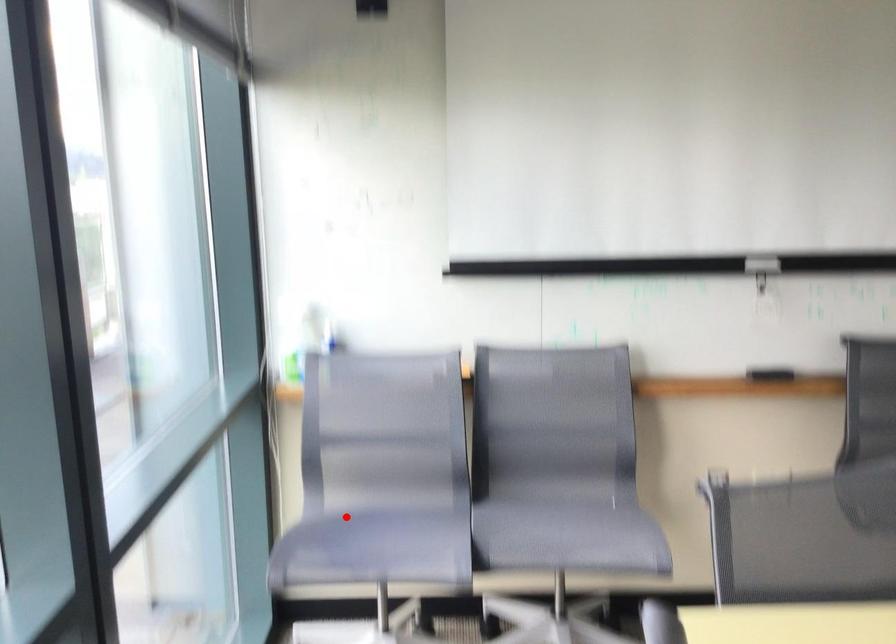
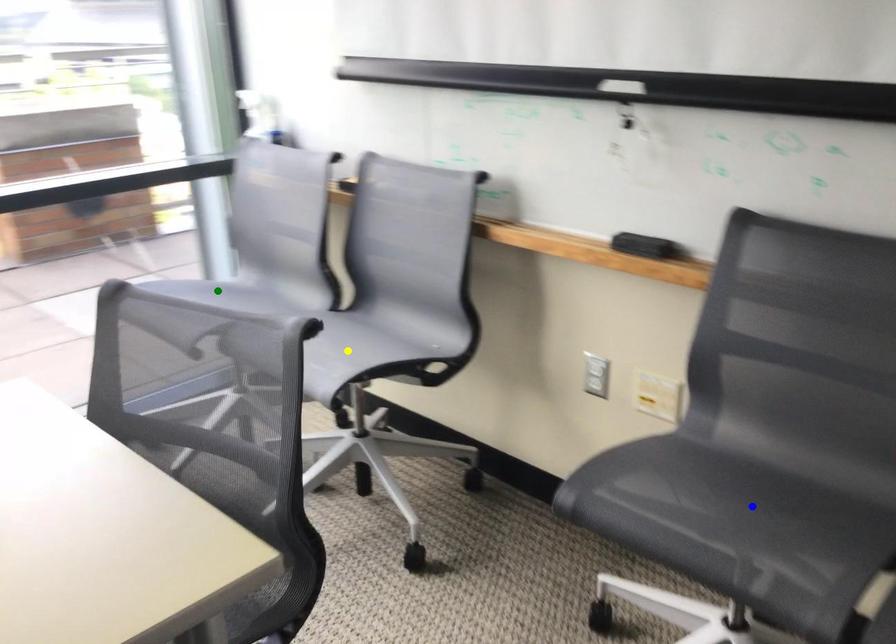
Question: I am providing you with two images of the same scene from different viewpoints. A red point is marked on the first image. You are given multiple points on the second image. Which point in image 2 represents the same 3d spot as the red point in image 1?

Choices:
 (A) blue point
 (B) green point
 (C) yellow point

Answer: (B)